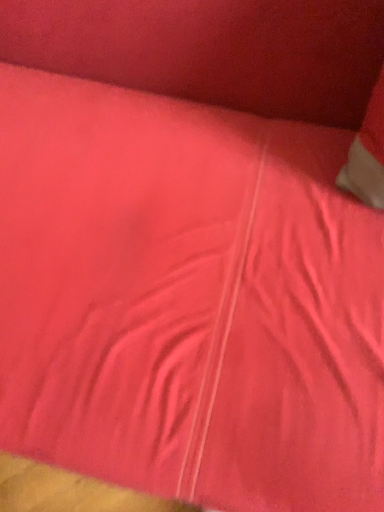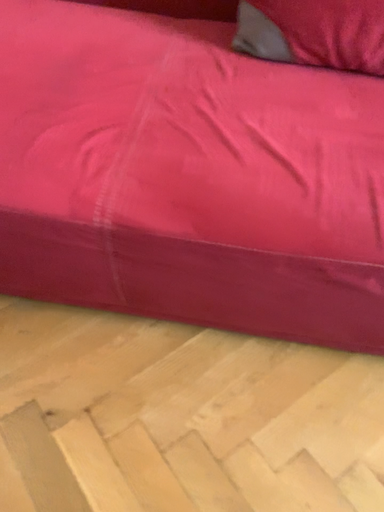
Question: Which way did the camera rotate in the video?

Choices:
 (A) rotated downward
 (B) rotated upward

Answer: (B)